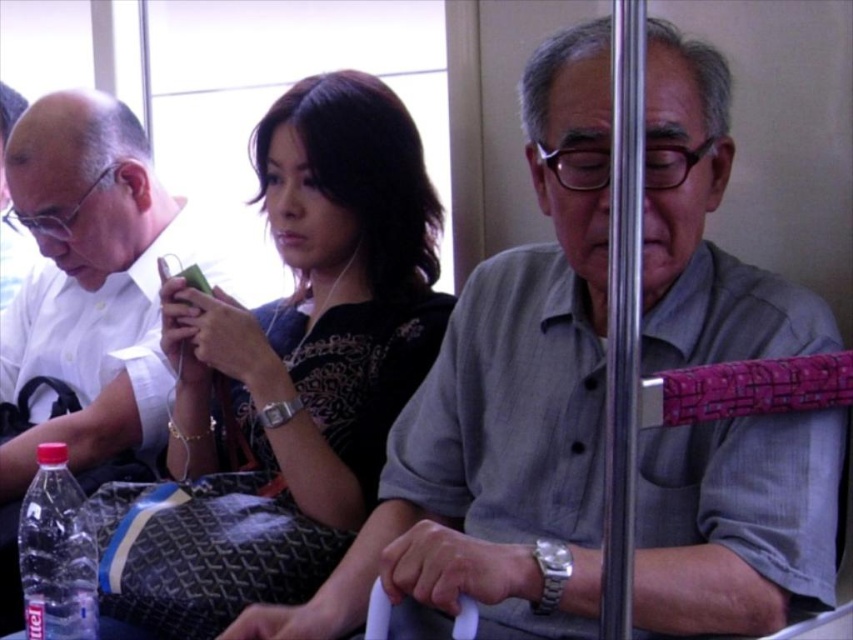
You are a passenger on this vehicle and want to take a photo of both point (585, 529) and point (256, 506). Which point should you focus on first to ensure both are in clear view?

You should focus on point (585, 529) first because it is closer to the camera than point (256, 506), ensuring both points are in clear view.

You are a photographer trying to capture a candid shot of the two people wearing the gray cotton shirt at center and matte black shirt at center in the foreground of a public transportation vehicle. Since you want to focus on their faces, which shirt should you adjust your camera to prioritize focusing on to ensure clarity?

The gray cotton shirt at center is closer to the viewer than the matte black shirt at center, so focusing on the gray cotton shirt at center will ensure clarity since it is nearer.

You are a passenger on a train and you see two shirts at the center of the scene. The shirts are described as gray cotton shirt at center and matte black shirt at center. Which shirt is positioned to the right of the other?

The gray cotton shirt at center is positioned to the right of the matte black shirt at center.